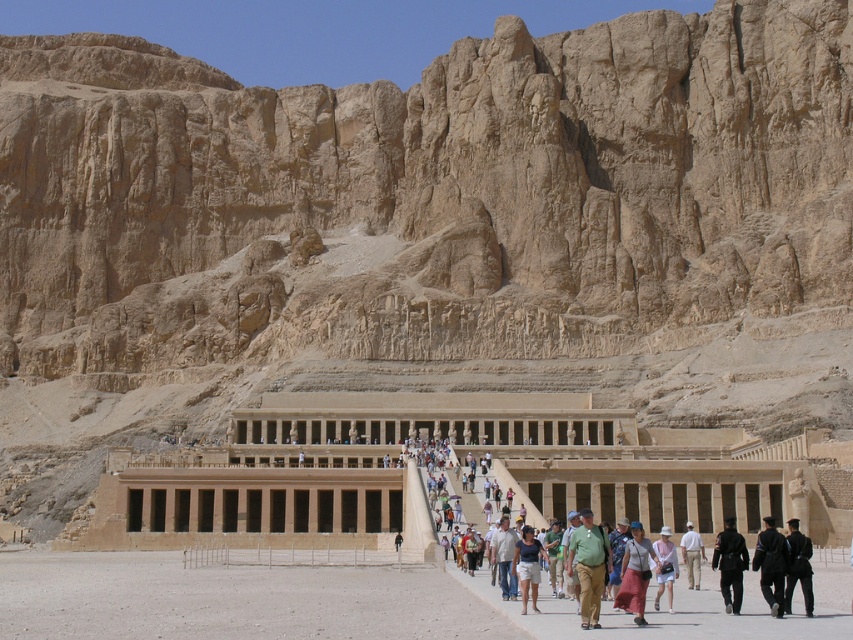
You are a visitor standing at the entrance of the ancient temple. You notice two people wearing the dark blue uniform at center and the light brown cotton shirt at center. Which person is standing closer to you?

The dark blue uniform at center is closer to the viewer than the light brown cotton shirt at center, so the person wearing the dark blue uniform at center is standing closer to you.

You are a tour guide leading a group at the ancient Egyptian temple. You notice two visitors wearing the dark blue uniform at center and the light brown cotton shirt at center. A visitor asks if they can stand side by side without overlapping. Based on their clothing, what do you tell them?

The dark blue uniform at center is wider than the light brown cotton shirt at center. Since the dark blue uniform is wider, they can stand side by side as long as there is enough space for both their widths combined.